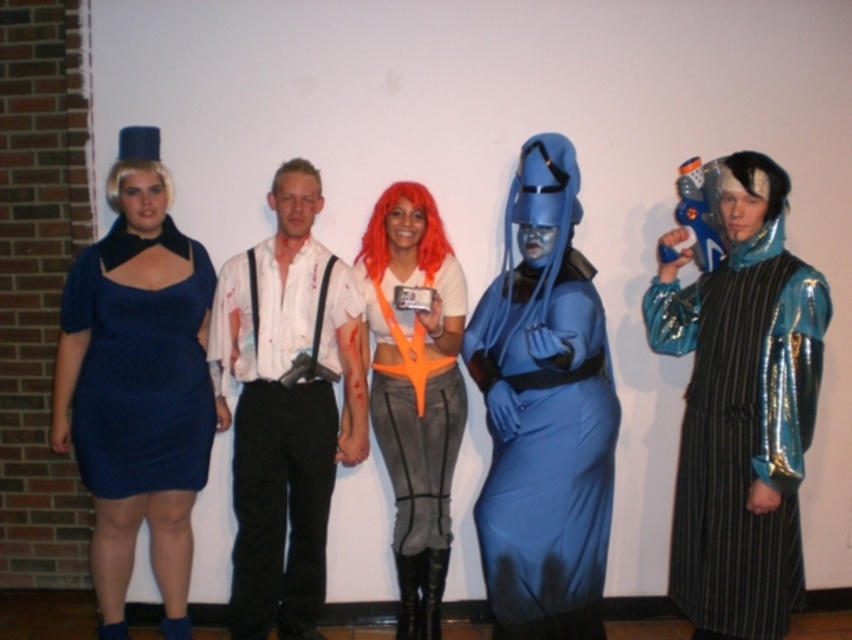
Describe the element at coordinates (544, 412) in the screenshot. This screenshot has height=640, width=852. I see `matte blue costume at center` at that location.

In the scene shown: Can you confirm if matte blue costume at center is shorter than white matte shirt at center?

Indeed, matte blue costume at center has a lesser height compared to white matte shirt at center.

Measure the distance between matte blue costume at center and camera.

matte blue costume at center and camera are 8.18 feet apart from each other.

Find the location of a particular element. The height and width of the screenshot is (640, 852). matte blue costume at center is located at coordinates (544, 412).

Can you confirm if metallic blue robe at center is thinner than matte blue dress at left?

Yes, metallic blue robe at center is thinner than matte blue dress at left.

How far apart are metallic blue robe at center and matte blue dress at left?

metallic blue robe at center and matte blue dress at left are 5.27 feet apart.

Who is more distant from viewer, [755,161] or [83,401]?

The point [83,401] is more distant.

Where is `metallic blue robe at center`? metallic blue robe at center is located at coordinates (741, 410).

Is metallic blue robe at center above orange fabric top at center?

Yes, metallic blue robe at center is above orange fabric top at center.

Does metallic blue robe at center have a lesser width compared to orange fabric top at center?

No, metallic blue robe at center is not thinner than orange fabric top at center.

This screenshot has height=640, width=852. I want to click on metallic blue robe at center, so click(x=741, y=410).